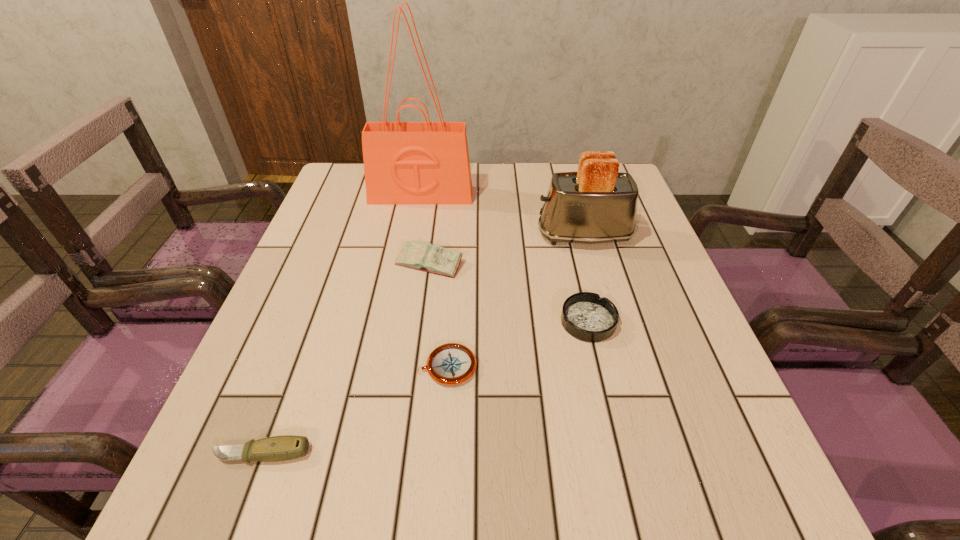
What are the coordinates of `tote bag` in the screenshot? It's located at (426, 162).

Locate an element on the screen. This screenshot has width=960, height=540. the tallest object is located at coordinates (426, 162).

Identify the location of the fifth shortest object. The image size is (960, 540). (598, 204).

You are a GUI agent. You are given a task and a screenshot of the screen. Output one action in this format:
    pyautogui.click(x=<x>, y=<y>)
    Task: Click on the fourth shortest object
    The image size is (960, 540).
    Given the screenshot: What is the action you would take?
    pyautogui.click(x=435, y=259)

Where is `ashtray`? ashtray is located at coordinates (586, 316).

The image size is (960, 540). What are the coordinates of `pocketknife` in the screenshot? It's located at (287, 447).

Where is `compass`? Image resolution: width=960 pixels, height=540 pixels. compass is located at coordinates click(x=450, y=364).

Locate an element on the screen. The image size is (960, 540). the shortest object is located at coordinates (450, 364).

The height and width of the screenshot is (540, 960). Identify the location of blank space located on the logo side of the farthest object. (405, 287).

Identify the location of vacant space located on the side of the fifth shortest object with the control lever. (485, 236).